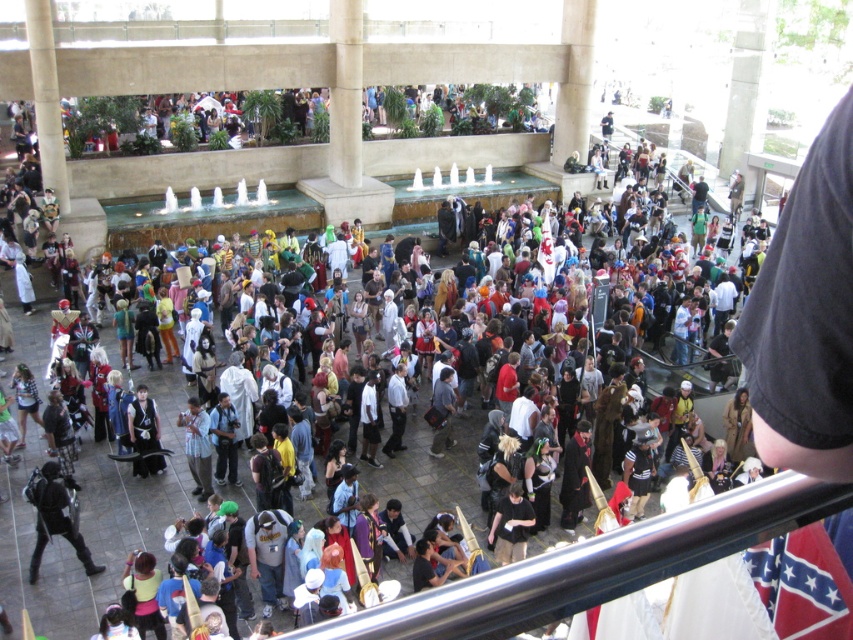
You are a convention attendee holding a 18 inch wide camera bag. You need to pass through a narrow corridor between the black matte backpack at lower left and the black leather jacket at center. Can your camera bag fit through the space between them?

The black matte backpack at lower left is wider than the black leather jacket at center. Since the camera bag is 18 inches wide, it depends on the actual width of the backpack and jacket. However, since the backpack is wider, there might be enough space if the total available width exceeds 18 inches. Without exact measurements, it is uncertain.

You are an attendee at this event and you want to reach the registration desk located behind the black leather jacket at center. You have a black matte backpack at lower left. Can you move your backpack out of the way to get a clearer path?

The black matte backpack at lower left is in front of the black leather jacket at center, so moving the backpack would allow you to have a clearer path to the registration desk behind the jacket.

You are an attendee at this event and need to decide whether to place your black leather jacket at center over your black matte backpack at lower left. Based on their sizes, will the jacket fit entirely on top of the backpack without hanging off?

The black matte backpack at lower left is taller than black leather jacket at center, so the jacket will fit entirely on top of the backpack without hanging off since the backpack is taller.